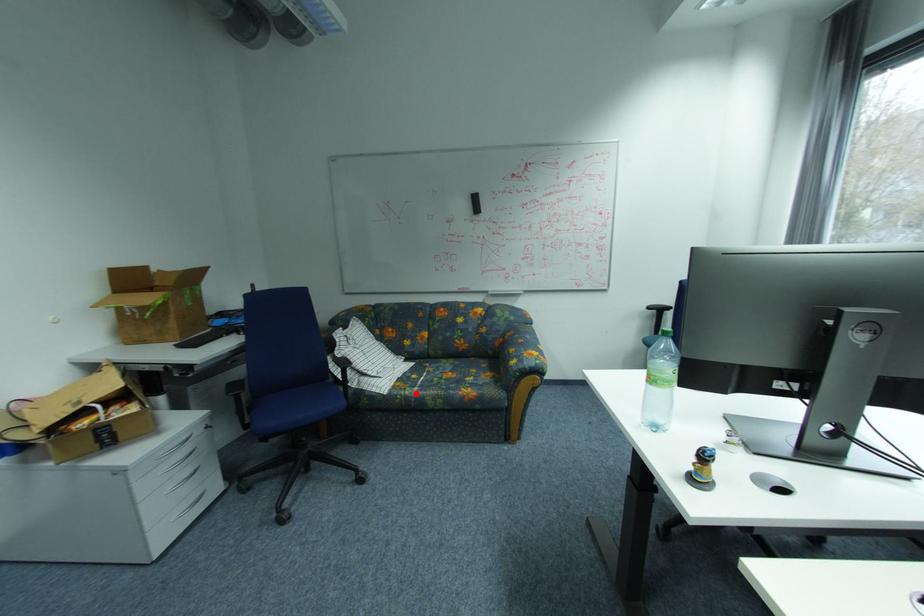
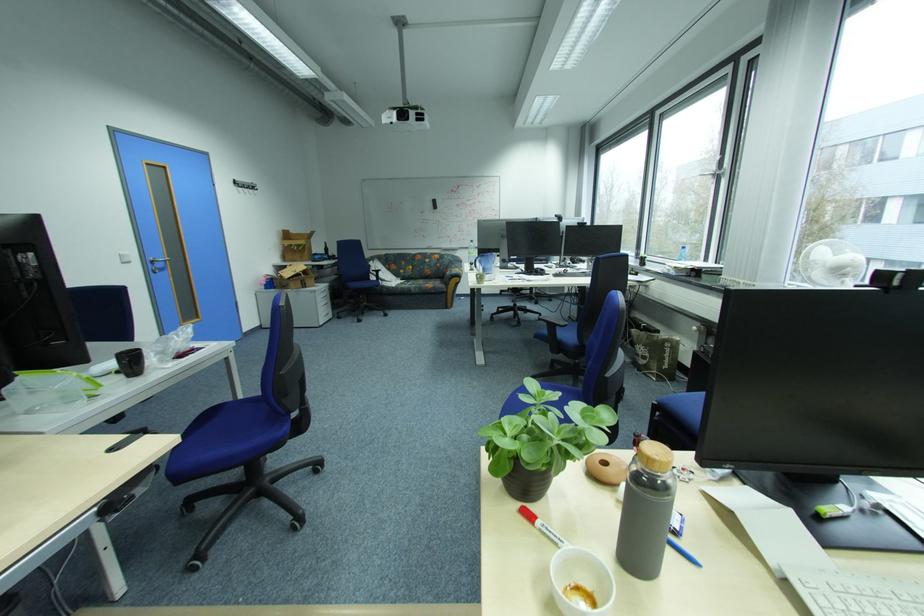
Locate, in the second image, the point that corresponds to the highlighted location in the first image.

(411, 286)